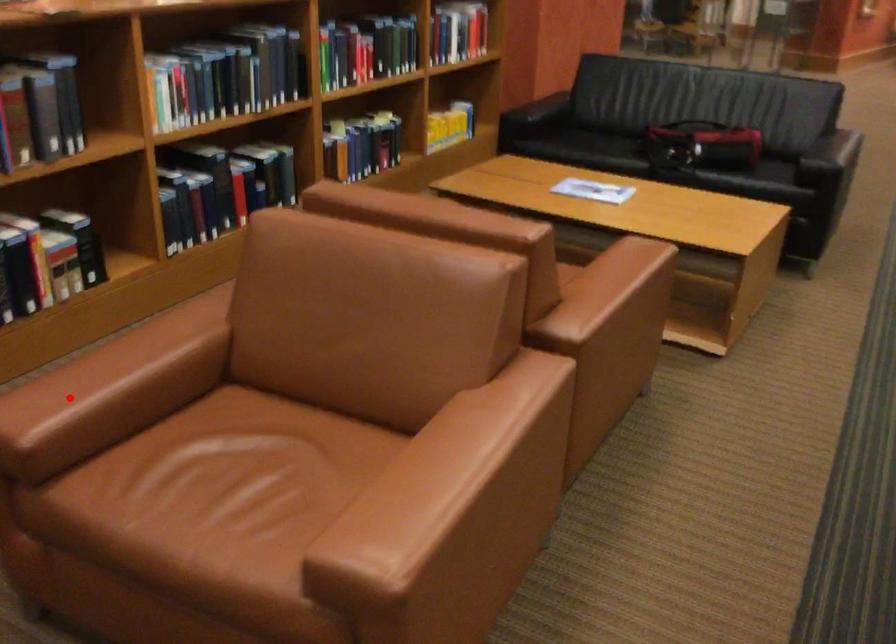
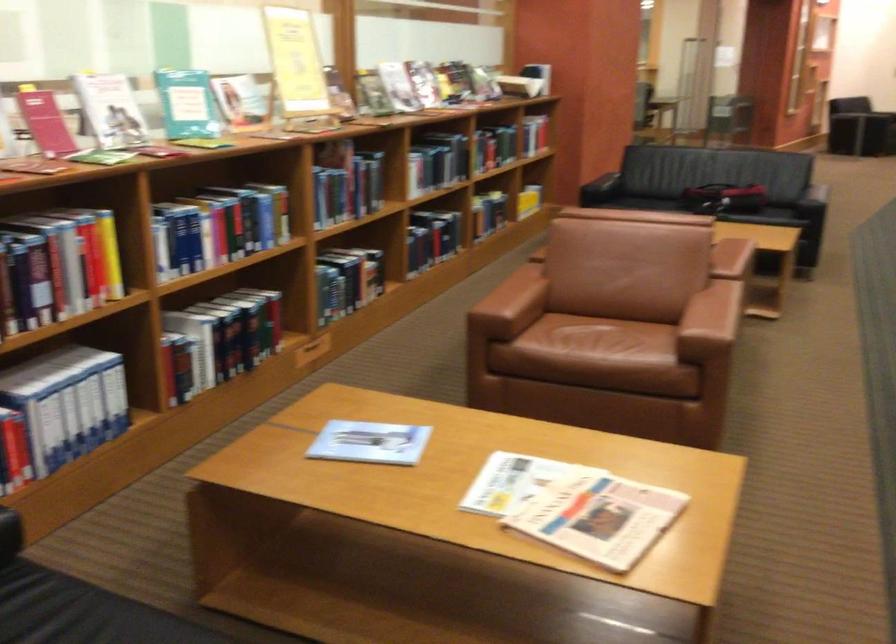
Where in the second image is the point corresponding to the highlighted location from the first image?

(510, 305)